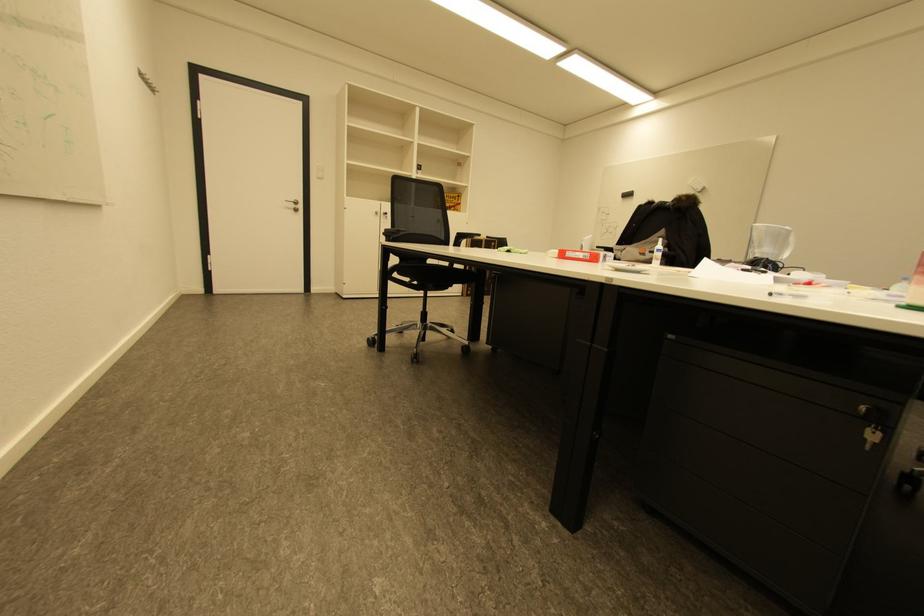
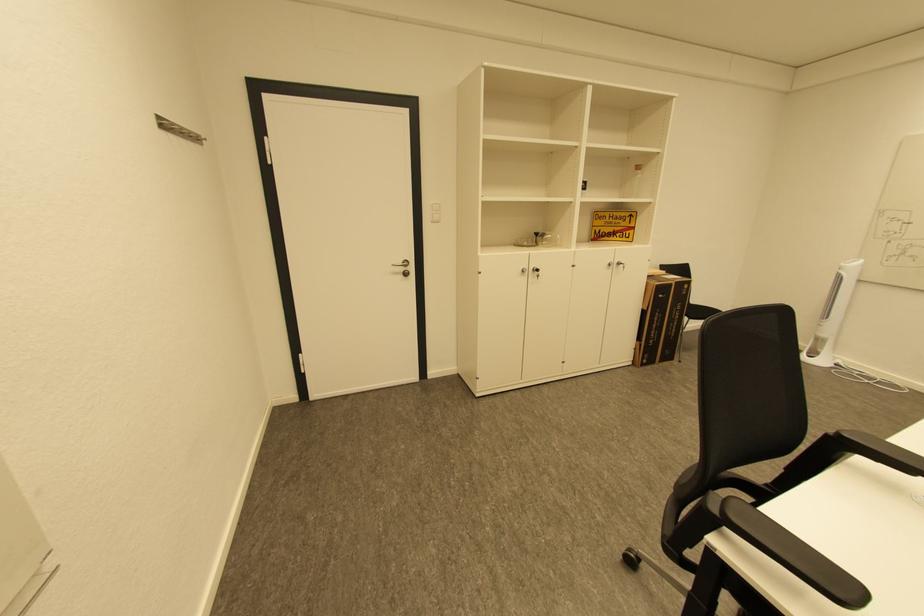
The point at [464,235] is marked in the first image. Where is the corresponding point in the second image?

(845, 436)